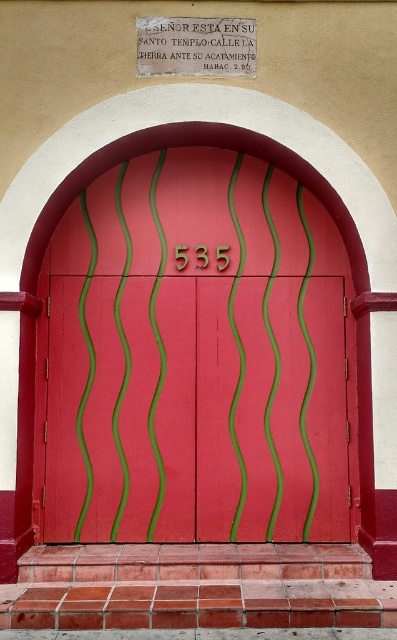
Is point (213, 502) positioned after point (254, 33)?

Yes, point (213, 502) is farther from viewer.

Is matte red wooden door at center wider than matte white stone plaque at upper center?

Indeed, matte red wooden door at center has a greater width compared to matte white stone plaque at upper center.

Locate an element on the screen. matte red wooden door at center is located at coordinates (196, 356).